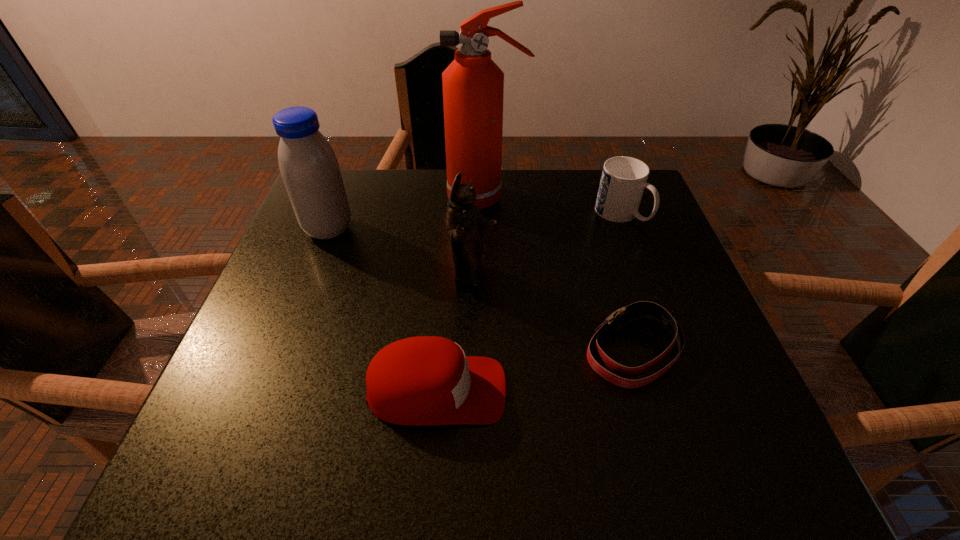
Where is `empty location between the soya milk and the second shortest object`? Image resolution: width=960 pixels, height=540 pixels. empty location between the soya milk and the second shortest object is located at coordinates (382, 310).

The image size is (960, 540). I want to click on free space between the leftmost object and the figurine, so click(x=400, y=253).

Where is `free spot between the fire extinguisher and the fourth tallest object`? free spot between the fire extinguisher and the fourth tallest object is located at coordinates (553, 206).

At what (x,y) coordinates should I click in order to perform the action: click on free space between the shortest object and the fourth farthest object. Please return your answer as a coordinate pair (x, y). The width and height of the screenshot is (960, 540). Looking at the image, I should click on (552, 314).

The width and height of the screenshot is (960, 540). What are the coordinates of `free area in between the dog collar and the fourth farthest object` in the screenshot? It's located at (552, 314).

Where is `vacant space that is in between the fire extinguisher and the baseball cap`? The height and width of the screenshot is (540, 960). vacant space that is in between the fire extinguisher and the baseball cap is located at coordinates (461, 295).

Locate an element on the screen. object identified as the fourth closest to the second shortest object is located at coordinates (473, 85).

Select which object is the fifth closest to the baseball cap. Please provide its 2D coordinates. Your answer should be formatted as a tuple, i.e. [(x, y)], where the tuple contains the x and y coordinates of a point satisfying the conditions above.

[(623, 180)]

Locate an element on the screen. Image resolution: width=960 pixels, height=540 pixels. free location that satisfies the following two spatial constraints: 1. on the back side of the shortest object; 2. at the nozzle of the fire extinguisher is located at coordinates (588, 199).

Find the location of `vacant region that satisfies the following two spatial constraints: 1. on the front-facing side of the fourth farthest object; 2. on the left side of the dog collar`. vacant region that satisfies the following two spatial constraints: 1. on the front-facing side of the fourth farthest object; 2. on the left side of the dog collar is located at coordinates (471, 350).